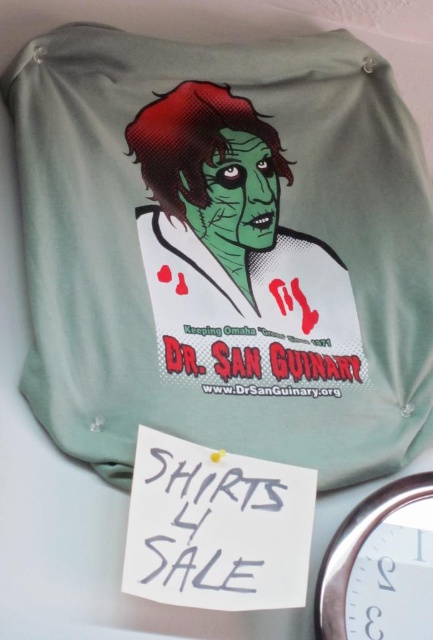
Question: Is matte green fabric lab coat at center to the right of white plastic clock at lower right from the viewer's perspective?

Choices:
 (A) yes
 (B) no

Answer: (B)

Question: Is matte green fabric lab coat at center thinner than green matte/soft dr san guinary at center?

Choices:
 (A) yes
 (B) no

Answer: (B)

Question: Which object is farther from the camera taking this photo?

Choices:
 (A) matte green fabric lab coat at center
 (B) white plastic clock at lower right
 (C) green matte/soft dr san guinary at center

Answer: (C)

Question: Which point is closer to the camera?

Choices:
 (A) (325, 186)
 (B) (341, 572)
 (C) (216, 104)

Answer: (B)

Question: Does matte green fabric lab coat at center appear on the right side of white plastic clock at lower right?

Choices:
 (A) no
 (B) yes

Answer: (A)

Question: Which point appears farthest from the camera in this image?

Choices:
 (A) (339, 328)
 (B) (3, 86)
 (C) (387, 580)

Answer: (A)